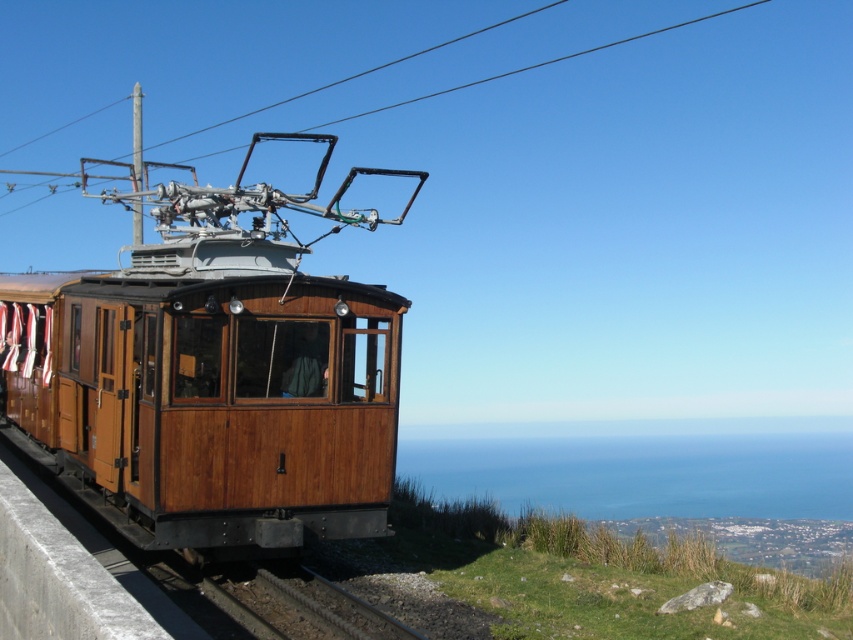
You are standing at the point marked by the coordinates (216, 372) on the image. What object are you directly at?

The point marked by the coordinates (216, 372) is directly at the wooden train car at center.

You are a maintenance worker inspecting the wooden train car at center and the dark brown metal train track at lower center. Which object is taller?

The wooden train car at center is taller than the dark brown metal train track at lower center.

You are standing in front of the vintage tram and want to take a photo. You notice two points marked on the tram, one at point coordinates point (288,566) and another at point coordinates point (254,112). Which point will appear larger in your photo?

Point (288,566) is closer to the camera than point (254,112), so it will appear larger in the photo.